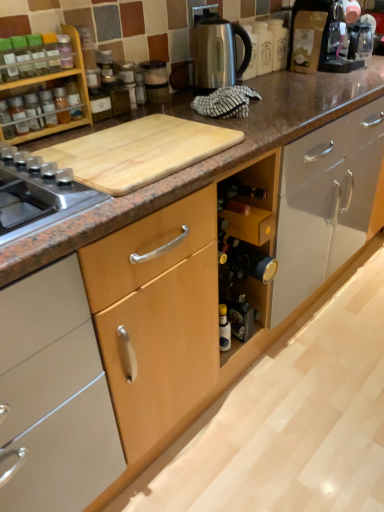
Question: Would you say translucent glass spice at upper left, the second bottle in the left-to-right sequence, is inside or outside satin silver kettle at upper center, which appears as the second appliance when viewed from the left?

Choices:
 (A) inside
 (B) outside

Answer: (B)

Question: Considering the relative positions of translucent glass spice at upper left, the 2th bottle when ordered from right to left, and satin silver kettle at upper center, which appears as the second appliance when viewed from the left, in the image provided, is translucent glass spice at upper left, the 2th bottle when ordered from right to left, to the left or to the right of satin silver kettle at upper center, which appears as the second appliance when viewed from the left,?

Choices:
 (A) right
 (B) left

Answer: (B)

Question: Which of these objects is positioned closest to the green glass wine bottle at center?

Choices:
 (A) translucent glass spice at upper left, the second bottle in the left-to-right sequence
 (B) matte glass bottle at left, positioned as the 1th bottle in left-to-right order
 (C) translucent glass spice at upper left, the 3th bottle positioned from the left
 (D) satin silver kettle at upper center, the first appliance positioned from the right
 (E) wooden spice rack at upper left

Answer: (E)

Question: Which object is positioned farthest from the wooden spice rack at upper left?

Choices:
 (A) matte glass bottle at left, the 3th bottle viewed from the right
 (B) translucent glass spice at upper left, the second bottle in the left-to-right sequence
 (C) translucent glass spice at upper left, marked as the first bottle in a right-to-left arrangement
 (D) metallic silver blender at upper center, positioned as the first appliance in left-to-right order
 (E) satin silver kettle at upper center, which appears as the second appliance when viewed from the left

Answer: (E)